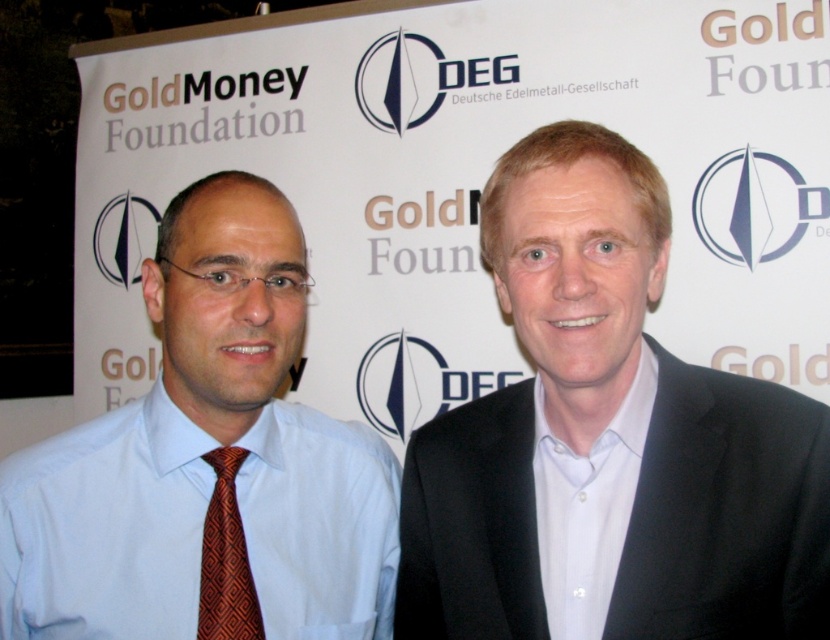
Question: Does black matte suit at right appear over orange patterned tie at left?

Choices:
 (A) no
 (B) yes

Answer: (B)

Question: Which of the following is the farthest from the observer?

Choices:
 (A) (533, 556)
 (B) (242, 538)
 (C) (134, 592)

Answer: (B)

Question: Which is nearer to the black matte suit at right?

Choices:
 (A) orange patterned tie at left
 (B) matte blue shirt at center

Answer: (B)

Question: Estimate the real-world distances between objects in this image. Which object is farther from the orange patterned tie at left?

Choices:
 (A) matte blue shirt at center
 (B) black matte suit at right

Answer: (B)

Question: Can you confirm if black matte suit at right is smaller than orange patterned tie at left?

Choices:
 (A) yes
 (B) no

Answer: (B)

Question: Is matte blue shirt at center above orange patterned tie at left?

Choices:
 (A) yes
 (B) no

Answer: (A)